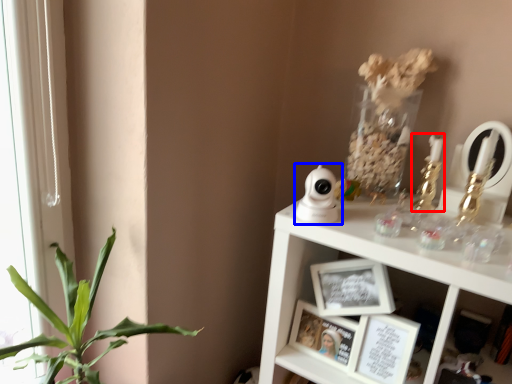
Question: Which object is closer to the camera taking this photo, candle holder (highlighted by a red box) or toy (highlighted by a blue box)?

Choices:
 (A) candle holder
 (B) toy

Answer: (B)